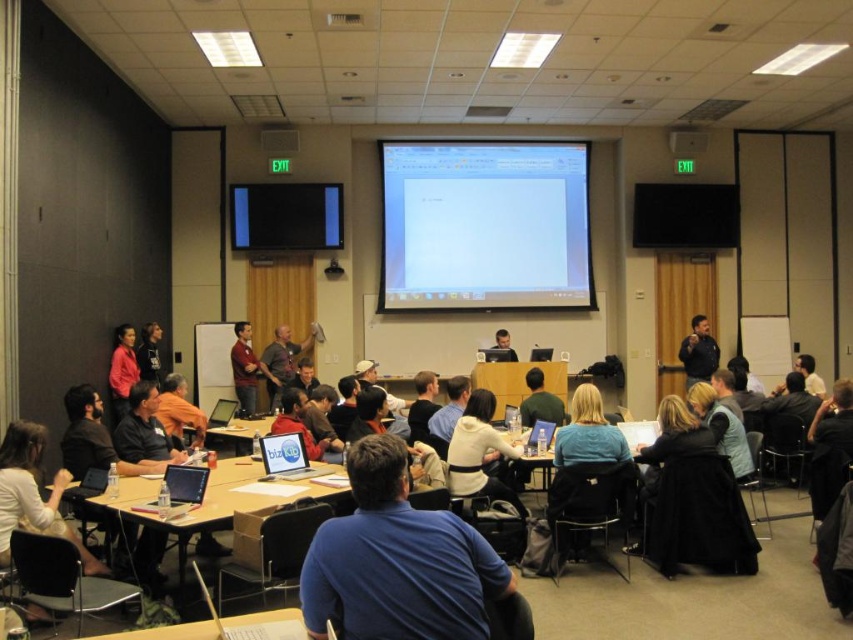
You are standing at the entrance of the conference room and want to walk directly to the matte plastic table at center. According to the room layout, where should you head?

The matte plastic table at center is located at the coordinates point (218, 500), so you should head towards the center area of the room where the table is positioned.

You are standing at the camera position in the conference room. The blue shirt at center is wearing a microphone. Can you hear the presenter clearly from where you are?

The blue shirt at center and camera are 5.66 meters apart. Since the distance is moderate, you should be able to hear the presenter clearly unless there is significant background noise.

You are an attendee in the conference room and want to take a photo of the blue shirt at center and the matte white board at upper center. Which object will appear bigger in your photo?

The blue shirt at center will appear bigger in the photo because it has a larger size compared to the matte white board at upper center.